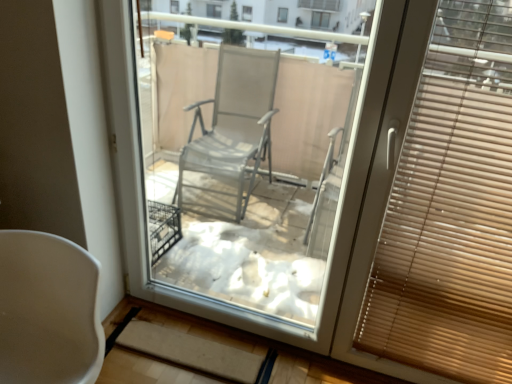
This screenshot has height=384, width=512. Describe the element at coordinates (48, 310) in the screenshot. I see `white matte chair at lower left` at that location.

You are a GUI agent. You are given a task and a screenshot of the screen. Output one action in this format:
    pyautogui.click(x=<x>, y=<y>)
    Task: Click on the white matte chair at lower left
    
    Given the screenshot: What is the action you would take?
    pyautogui.click(x=48, y=310)

Where is `wooden blinds at right`? The image size is (512, 384). wooden blinds at right is located at coordinates (439, 206).

What is the approximate width of wooden blinds at right?

3.01 inches.

What do you see at coordinates (439, 206) in the screenshot?
I see `wooden blinds at right` at bounding box center [439, 206].

Measure the distance between point (426, 285) and camera.

4.92 feet.

Locate an element on the screen. white matte chair at lower left is located at coordinates (48, 310).

Which is more to the left, white matte chair at lower left or wooden blinds at right?

white matte chair at lower left.

Is white matte chair at lower left further to camera compared to wooden blinds at right?

No, it is not.

Does point (65, 283) come behind point (452, 13)?

Yes, it is behind point (452, 13).

From the image's perspective, is white matte chair at lower left located above wooden blinds at right?

No, from the image's perspective, white matte chair at lower left is not on top of wooden blinds at right.

From a real-world perspective, is white matte chair at lower left positioned under wooden blinds at right based on gravity?

Indeed, from a real-world perspective, white matte chair at lower left is positioned beneath wooden blinds at right.

Considering the sizes of white matte chair at lower left and wooden blinds at right in the image, is white matte chair at lower left wider or thinner than wooden blinds at right?

white matte chair at lower left is wider than wooden blinds at right.

Is white matte chair at lower left taller than wooden blinds at right?

In fact, white matte chair at lower left may be shorter than wooden blinds at right.

Looking at the image, does white matte chair at lower left seem bigger or smaller compared to wooden blinds at right?

Considering their sizes, white matte chair at lower left takes up more space than wooden blinds at right.

Can we say white matte chair at lower left lies outside wooden blinds at right?

Indeed, white matte chair at lower left is completely outside wooden blinds at right.

Looking at this image, are white matte chair at lower left and wooden blinds at right far apart?

Yes.

Does white matte chair at lower left turn towards wooden blinds at right?

No.

I want to click on window blind that appears behind the white matte chair at lower left, so click(439, 206).

Is wooden blinds at right to the right of white matte chair at lower left from the viewer's perspective?

Yes.

Which is in front, wooden blinds at right or white matte chair at lower left?

white matte chair at lower left is more forward.

Which point is more forward, (495, 354) or (21, 254)?

The point (21, 254) is in front.

From the image's perspective, relative to white matte chair at lower left, is wooden blinds at right above or below?

Clearly, from the image's perspective, wooden blinds at right is above white matte chair at lower left.

From a real-world perspective, does wooden blinds at right sit lower than white matte chair at lower left?

No.

Is wooden blinds at right wider or thinner than white matte chair at lower left?

Considering their sizes, wooden blinds at right looks slimmer than white matte chair at lower left.

Looking at this image, is wooden blinds at right taller than white matte chair at lower left?

Indeed, wooden blinds at right has a greater height compared to white matte chair at lower left.

Which of these two, wooden blinds at right or white matte chair at lower left, is smaller?

wooden blinds at right.

Is wooden blinds at right not within white matte chair at lower left?

Yes, wooden blinds at right is located beyond the bounds of white matte chair at lower left.

In the scene shown: Are wooden blinds at right and white matte chair at lower left far apart?

Absolutely, wooden blinds at right is distant from white matte chair at lower left.

From the picture: Is wooden blinds at right oriented towards white matte chair at lower left?

No, wooden blinds at right is not aimed at white matte chair at lower left.

Can you tell me how much wooden blinds at right and white matte chair at lower left differ in facing direction?

wooden blinds at right and white matte chair at lower left are facing 0.443 degrees away from each other.

Identify the location of window blind above the white matte chair at lower left (from the image's perspective). Image resolution: width=512 pixels, height=384 pixels. (439, 206).

Locate an element on the screen. Image resolution: width=512 pixels, height=384 pixels. window blind behind the white matte chair at lower left is located at coordinates (439, 206).

In the image, there is a wooden blinds at right. Identify the location of chair below it (from a real-world perspective). (48, 310).